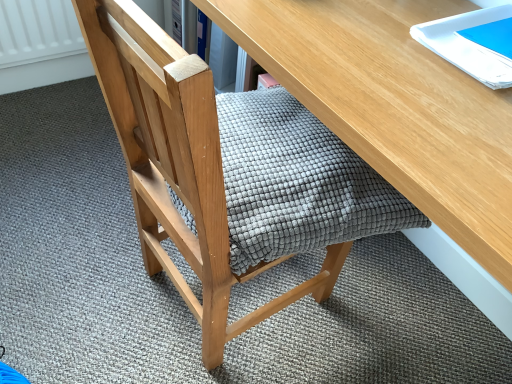
At what (x,y) coordinates should I click in order to perform the action: click on vacant area situated to the left side of wooden desk at center. Please return your answer as a coordinate pair (x, y). The width and height of the screenshot is (512, 384). Looking at the image, I should click on (69, 232).